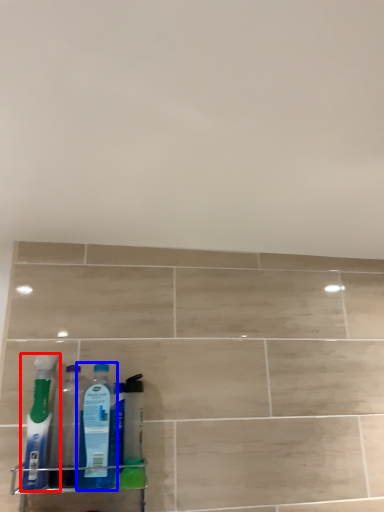
Question: Which point is closer to the camera, bottle (highlighted by a red box) or bottle (highlighted by a blue box)?

Choices:
 (A) bottle
 (B) bottle

Answer: (A)